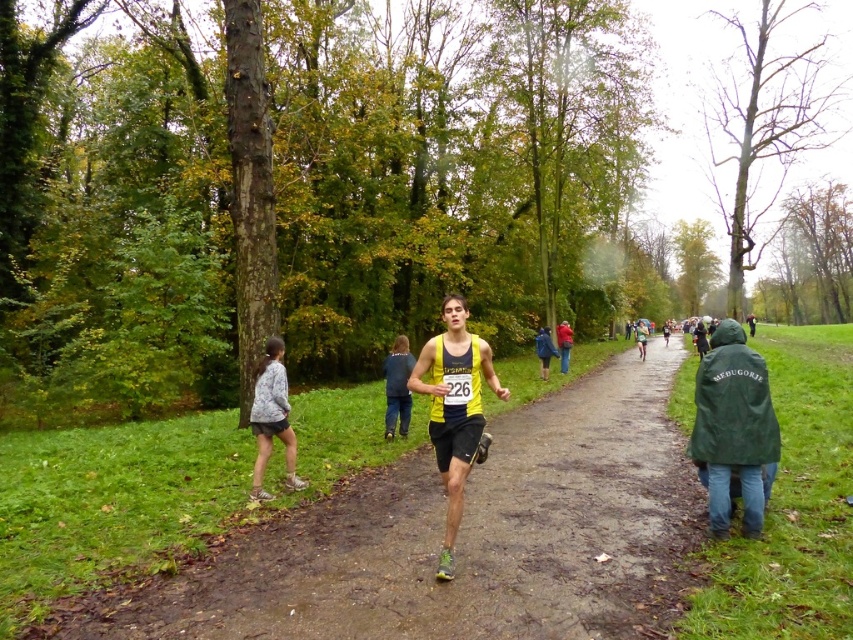
You are a photographer positioned at the point with coordinates point (466,538). You want to capture a photo of the yellow fabric runner at center. Is the yellow fabric runner at center in your current field of view?

The yellow fabric runner at center is represented by point 0.847, so yes, the photographer is positioned at that point and can capture the yellow fabric runner at center in their current field of view.